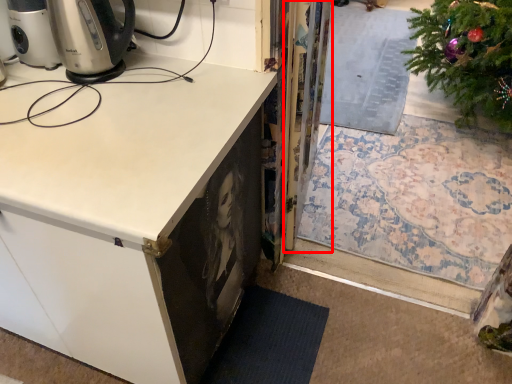
Question: From the image, what is the correct spatial relationship of screen door (annotated by the red box) in relation to cabinetry?

Choices:
 (A) left
 (B) right

Answer: (B)